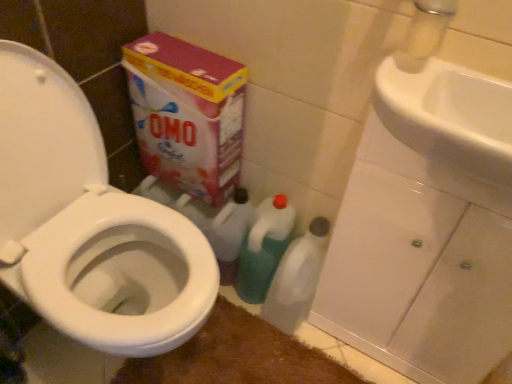
The image size is (512, 384). What do you see at coordinates (425, 33) in the screenshot?
I see `metallic silver faucet at upper right` at bounding box center [425, 33].

What do you see at coordinates (89, 224) in the screenshot? I see `white glossy toilet at left` at bounding box center [89, 224].

Where is `white glossy sink at upper right`? Image resolution: width=512 pixels, height=384 pixels. white glossy sink at upper right is located at coordinates (448, 113).

This screenshot has width=512, height=384. Find the location of `multicolored cardboard box at upper left`. multicolored cardboard box at upper left is located at coordinates (187, 114).

Is there a large distance between brown plush bath mat at lower center and white glossy sink at upper right?

No.

Between point (249, 357) and point (508, 154), which one is positioned in front?

The point (508, 154) is in front.

Which object is closer to the camera taking this photo, brown plush bath mat at lower center or white glossy sink at upper right?

Positioned in front is white glossy sink at upper right.

Would you say multicolored cardboard box at upper left is part of metallic silver faucet at upper right's contents?

No, metallic silver faucet at upper right does not contain multicolored cardboard box at upper left.

Does metallic silver faucet at upper right appear on the right side of multicolored cardboard box at upper left?

Correct, you'll find metallic silver faucet at upper right to the right of multicolored cardboard box at upper left.

Is metallic silver faucet at upper right aimed at multicolored cardboard box at upper left?

No, metallic silver faucet at upper right does not turn towards multicolored cardboard box at upper left.

Is transparent plastic bottle at lower center, positioned as the 2th cleaning product in left-to-right order, far from green plastic bottle at center, which is the 1th cleaning product from left to right?

That's not correct — transparent plastic bottle at lower center, positioned as the 2th cleaning product in left-to-right order, is a little close to green plastic bottle at center, which is the 1th cleaning product from left to right.

Consider the image. Which of these two, transparent plastic bottle at lower center, which appears as the 1th cleaning product when viewed from the right, or green plastic bottle at center, which is the 1th cleaning product from left to right, is smaller?

transparent plastic bottle at lower center, which appears as the 1th cleaning product when viewed from the right, is smaller.

From a real-world perspective, is transparent plastic bottle at lower center, positioned as the 2th cleaning product in left-to-right order, above or below green plastic bottle at center, arranged as the second cleaning product when viewed from the right?

In terms of real-world spatial position, transparent plastic bottle at lower center, positioned as the 2th cleaning product in left-to-right order, is below green plastic bottle at center, arranged as the second cleaning product when viewed from the right.

Could you tell me if transparent plastic bottle at lower center, which appears as the 1th cleaning product when viewed from the right, is facing green plastic bottle at center, arranged as the second cleaning product when viewed from the right?

No, transparent plastic bottle at lower center, which appears as the 1th cleaning product when viewed from the right, is not aimed at green plastic bottle at center, arranged as the second cleaning product when viewed from the right.

Which is nearer, (252, 293) or (221, 64)?

The point (221, 64) is closer to the camera.

Does green plastic bottle at center, which is the 1th cleaning product from left to right, have a larger size compared to multicolored cardboard box at upper left?

Actually, green plastic bottle at center, which is the 1th cleaning product from left to right, might be smaller than multicolored cardboard box at upper left.

Is multicolored cardboard box at upper left surrounded by green plastic bottle at center, arranged as the second cleaning product when viewed from the right?

No, green plastic bottle at center, arranged as the second cleaning product when viewed from the right, does not contain multicolored cardboard box at upper left.

From the multicolored cardboard box at upper left, count 1st cleaning product to the right and point to it. Please provide its 2D coordinates.

[(264, 248)]

Consider the image. Does brown plush bath mat at lower center have a greater height compared to green plastic bottle at center, which is the 1th cleaning product from left to right?

In fact, brown plush bath mat at lower center may be shorter than green plastic bottle at center, which is the 1th cleaning product from left to right.

Are brown plush bath mat at lower center and green plastic bottle at center, which is the 1th cleaning product from left to right, far apart?

That's not correct — brown plush bath mat at lower center is a little close to green plastic bottle at center, which is the 1th cleaning product from left to right.

From the image's perspective, is brown plush bath mat at lower center located beneath green plastic bottle at center, which is the 1th cleaning product from left to right?

Yes.

Image resolution: width=512 pixels, height=384 pixels. I want to click on sink on the right of the metallic silver faucet at upper right, so pyautogui.click(x=448, y=113).

Looking at this image, considering the sizes of metallic silver faucet at upper right and white glossy sink at upper right in the image, is metallic silver faucet at upper right bigger or smaller than white glossy sink at upper right?

metallic silver faucet at upper right is smaller than white glossy sink at upper right.

Measure the distance between metallic silver faucet at upper right and white glossy sink at upper right.

They are 10.74 centimeters apart.

From a real-world perspective, which object rests below the other?

white glossy sink at upper right is physically lower.

Is point (229, 135) positioned after point (288, 302)?

No, (229, 135) is in front of (288, 302).

Could you tell me if multicolored cardboard box at upper left is facing transparent plastic bottle at lower center, positioned as the 2th cleaning product in left-to-right order?

No, multicolored cardboard box at upper left is not aimed at transparent plastic bottle at lower center, positioned as the 2th cleaning product in left-to-right order.

Does multicolored cardboard box at upper left lie behind transparent plastic bottle at lower center, which appears as the 1th cleaning product when viewed from the right?

No, it is not.

At what (x,y) coordinates should I click in order to perform the action: click on sink in front of the brown plush bath mat at lower center. Please return your answer as a coordinate pair (x, y). The image size is (512, 384). Looking at the image, I should click on (448, 113).

Locate an element on the screen. The image size is (512, 384). faucet that is above the multicolored cardboard box at upper left (from a real-world perspective) is located at coordinates (425, 33).

When comparing their distances from white glossy toilet at left, does brown plush bath mat at lower center or white glossy sink at upper right seem further?

Based on the image, white glossy sink at upper right appears to be further to white glossy toilet at left.

When comparing their distances from transparent plastic bottle at lower center, positioned as the 2th cleaning product in left-to-right order, does brown plush bath mat at lower center or multicolored cardboard box at upper left seem closer?

Among the two, brown plush bath mat at lower center is located nearer to transparent plastic bottle at lower center, positioned as the 2th cleaning product in left-to-right order.

Based on their spatial positions, is white glossy toilet at left or brown plush bath mat at lower center closer to transparent plastic bottle at lower center, positioned as the 2th cleaning product in left-to-right order?

brown plush bath mat at lower center is positioned closer to the anchor transparent plastic bottle at lower center, positioned as the 2th cleaning product in left-to-right order.

When comparing their distances from white glossy toilet at left, does green plastic bottle at center, which is the 1th cleaning product from left to right, or brown plush bath mat at lower center seem further?

Based on the image, brown plush bath mat at lower center appears to be further to white glossy toilet at left.

Based on their spatial positions, is white glossy sink at upper right or transparent plastic bottle at lower center, positioned as the 2th cleaning product in left-to-right order, further from white glossy toilet at left?

white glossy sink at upper right is positioned further to the anchor white glossy toilet at left.

From the image, which object appears to be farther from multicolored cardboard box at upper left, white glossy sink at upper right or white glossy toilet at left?

Based on the image, white glossy sink at upper right appears to be further to multicolored cardboard box at upper left.

Which object lies further to the anchor point brown plush bath mat at lower center, multicolored cardboard box at upper left or green plastic bottle at center, which is the 1th cleaning product from left to right?

multicolored cardboard box at upper left lies further to brown plush bath mat at lower center than the other object.

From the image, which object appears to be farther from multicolored cardboard box at upper left, metallic silver faucet at upper right or transparent plastic bottle at lower center, which appears as the 1th cleaning product when viewed from the right?

metallic silver faucet at upper right.

Identify the location of cleaning product that lies between multicolored cardboard box at upper left and transparent plastic bottle at lower center, which appears as the 1th cleaning product when viewed from the right, from top to bottom. (264, 248).

Identify the location of bath mat situated between white glossy toilet at left and white glossy sink at upper right from left to right. (238, 356).

Where is `toilet that lies between metallic silver faucet at upper right and brown plush bath mat at lower center from top to bottom`? The width and height of the screenshot is (512, 384). toilet that lies between metallic silver faucet at upper right and brown plush bath mat at lower center from top to bottom is located at coordinates (89, 224).

At what (x,y) coordinates should I click in order to perform the action: click on cardboard box between white glossy toilet at left and transparent plastic bottle at lower center, which appears as the 1th cleaning product when viewed from the right, from front to back. Please return your answer as a coordinate pair (x, y). The image size is (512, 384). Looking at the image, I should click on pos(187,114).